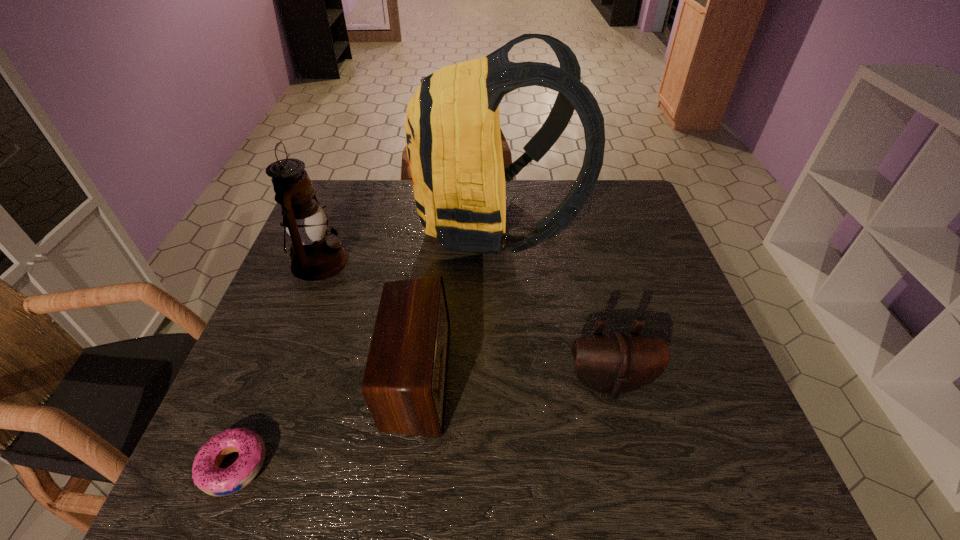
This screenshot has height=540, width=960. Identify the location of vacant area that lies between the fourth shortest object and the pouch. (465, 322).

At what (x,y) coordinates should I click in order to perform the action: click on vacant area between the lantern and the pouch. Please return your answer as a coordinate pair (x, y). This screenshot has height=540, width=960. Looking at the image, I should click on (465, 322).

At what (x,y) coordinates should I click in order to perform the action: click on free space between the radio receiver and the doughnut. Please return your answer as a coordinate pair (x, y). This screenshot has width=960, height=540. Looking at the image, I should click on (325, 421).

Point out which object is positioned as the fourth nearest to the doughnut. Please provide its 2D coordinates. Your answer should be formatted as a tuple, i.e. [(x, y)], where the tuple contains the x and y coordinates of a point satisfying the conditions above.

[(613, 363)]

Where is `object that stands as the second closest to the radio receiver`? object that stands as the second closest to the radio receiver is located at coordinates (207, 475).